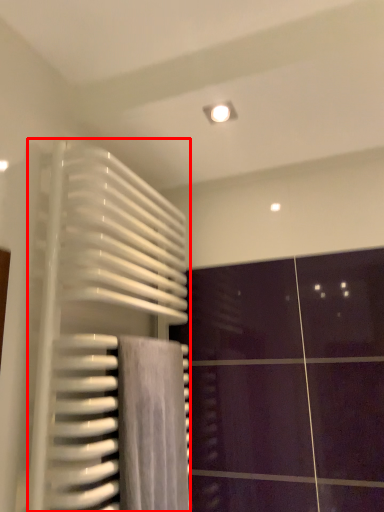
Question: From the image's perspective, what is the correct spatial positioning of radiator (annotated by the red box) in reference to bath towel?

Choices:
 (A) above
 (B) below

Answer: (A)